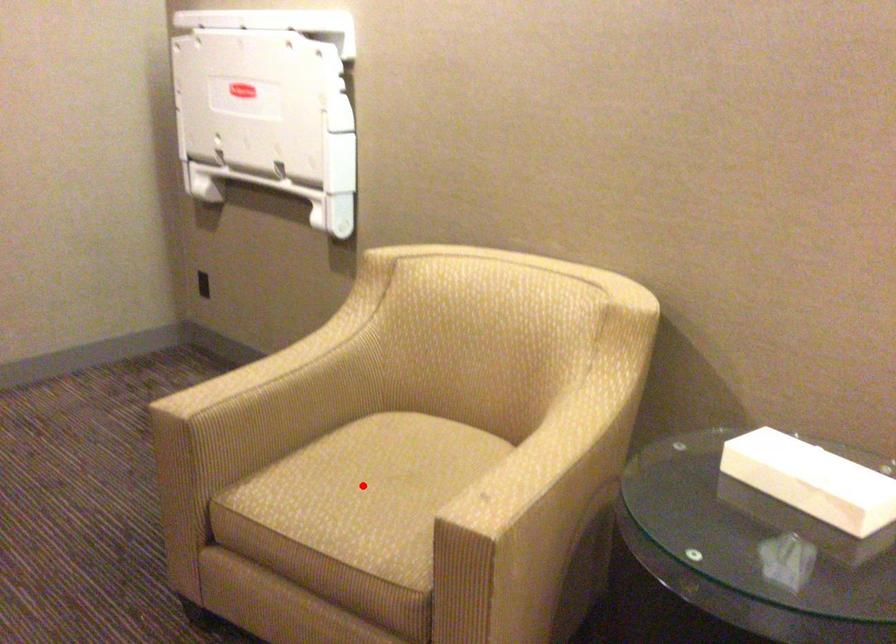
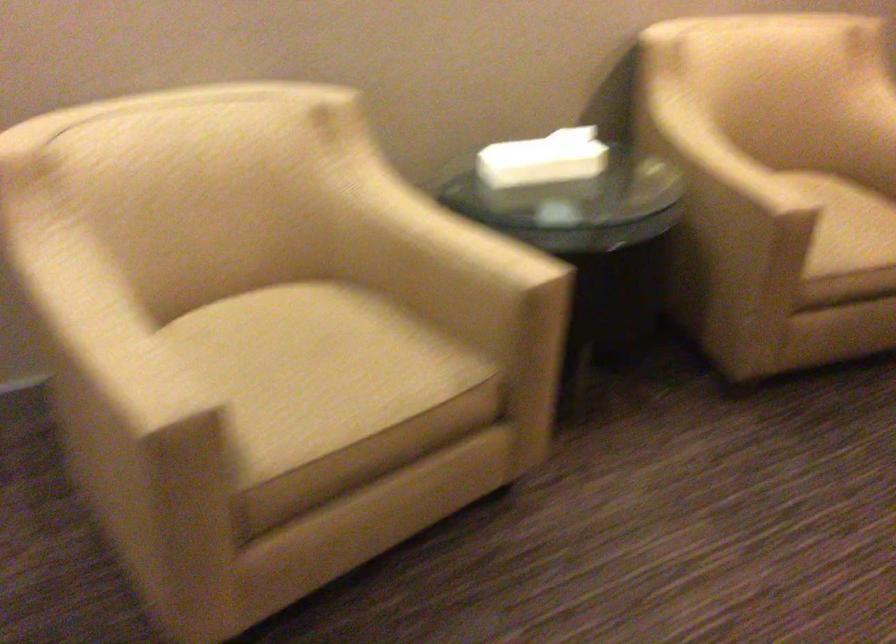
Locate, in the second image, the point that corresponds to the highlighted location in the first image.

(316, 370)